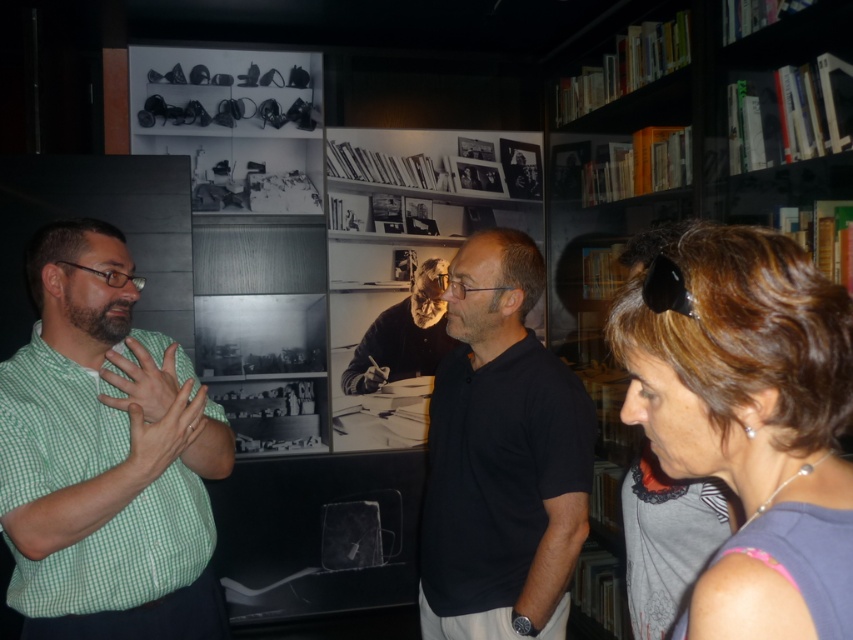
You are a photographer standing in the same room and want to take a photo of the gray fabric shirt at right and the black matte shirt at center. Given that your camera has a maximum focus range of 35 inches, will you be able to capture both subjects in focus without moving closer?

The gray fabric shirt at right is 37.61 inches from the black matte shirt at center. Since the distance between them exceeds the camera maximum focus range of 35 inches, you will not be able to capture both subjects in focus without moving closer.

You are standing in the museum and want to approach the person wearing the gray fabric shirt at right and the dark gray sweater at center. Which one can you reach first without moving past the other?

You can reach the gray fabric shirt at right first because it is closer to the viewer than the dark gray sweater at center.